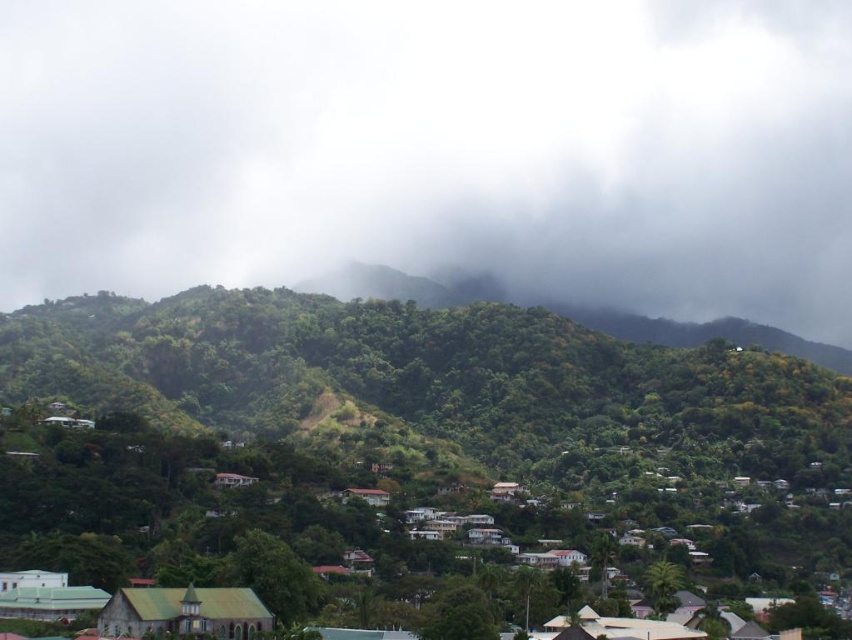
Question: Estimate the real-world distances between objects in this image. Which object is closer to the white fluffy cloud at upper center?

Choices:
 (A) green corrugated metal roof at lower left
 (B) green leafy forest at center

Answer: (B)

Question: Considering the real-world distances, which object is farthest from the brown wooden hut at center?

Choices:
 (A) green leafy forest at center
 (B) white fluffy cloud at upper center
 (C) green corrugated metal roof at lower left

Answer: (B)

Question: Can you confirm if green leafy forest at center is wider than brown wooden hut at center?

Choices:
 (A) yes
 (B) no

Answer: (A)

Question: Which of the following is the closest to the observer?

Choices:
 (A) (60, 132)
 (B) (251, 605)
 (C) (743, 380)
 (D) (367, 502)

Answer: (B)

Question: From the image, what is the correct spatial relationship of green leafy forest at center in relation to green corrugated metal roof at lower left?

Choices:
 (A) right
 (B) left

Answer: (A)

Question: Is green corrugated metal roof at lower left positioned behind brown wooden hut at center?

Choices:
 (A) yes
 (B) no

Answer: (B)